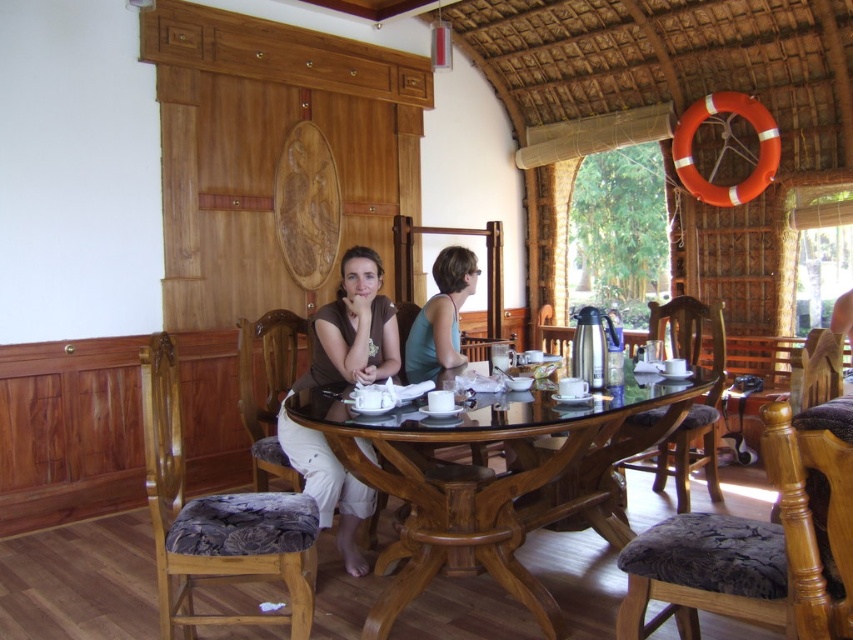
Where is `mahogany wood table at center`? This screenshot has height=640, width=853. mahogany wood table at center is located at coordinates (496, 480).

Image resolution: width=853 pixels, height=640 pixels. Describe the element at coordinates (496, 480) in the screenshot. I see `mahogany wood table at center` at that location.

Measure the distance between point (486,536) and camera.

8.49 feet

The height and width of the screenshot is (640, 853). Find the location of `mahogany wood table at center`. mahogany wood table at center is located at coordinates (496, 480).